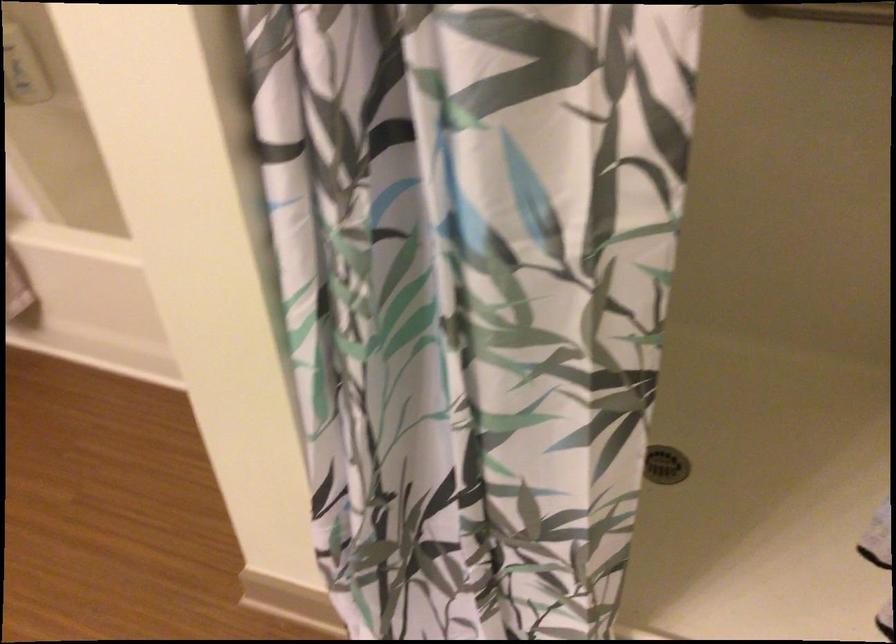
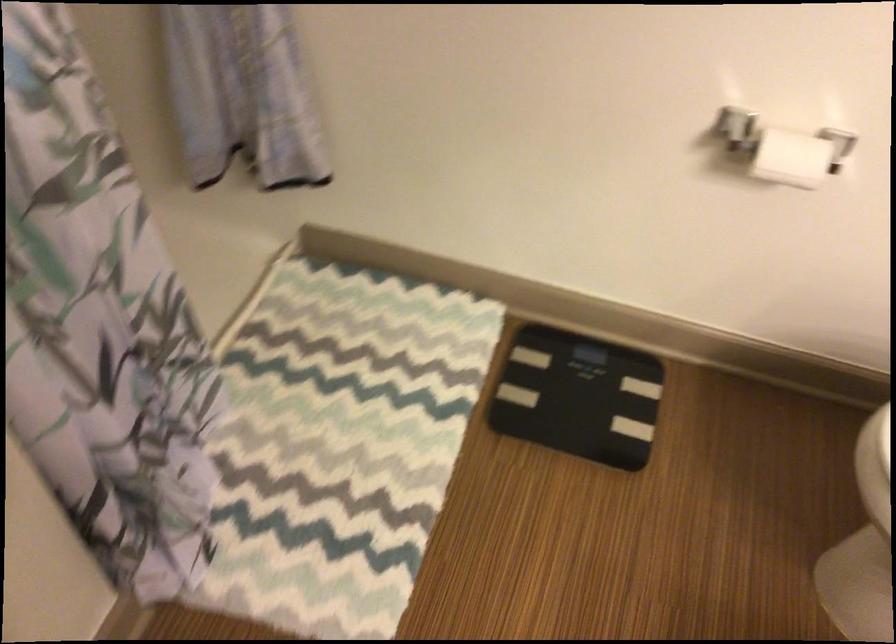
Based on the continuous images, in which direction is the camera rotating?

The camera rotated toward right-down.